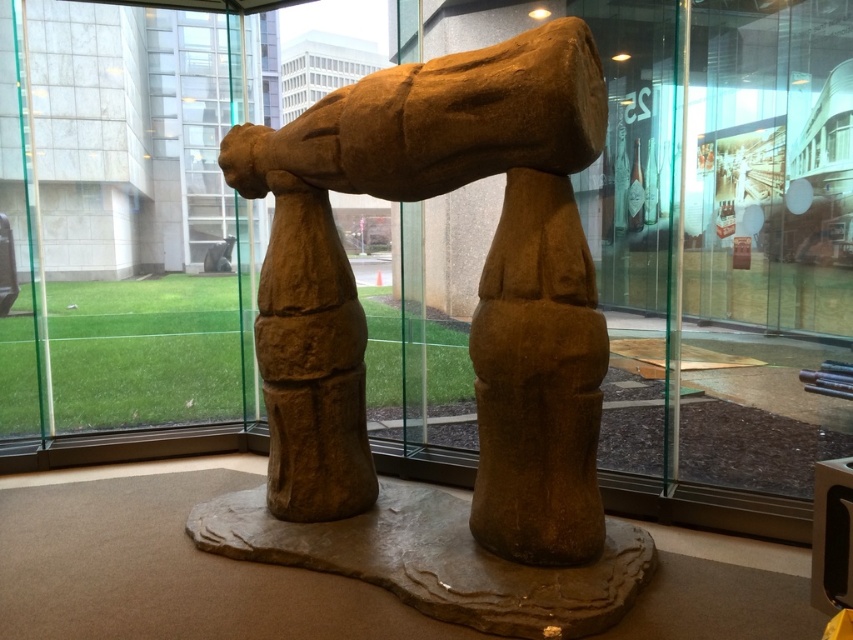
Question: Which point appears closest to the camera in this image?

Choices:
 (A) (216, 182)
 (B) (381, 512)

Answer: (B)

Question: Can you confirm if brown stone sculpture at center is thinner than transparent glass door at upper left?

Choices:
 (A) no
 (B) yes

Answer: (A)

Question: Which object is farther from the camera taking this photo?

Choices:
 (A) brown stone sculpture at center
 (B) transparent glass door at upper left

Answer: (B)

Question: Can you confirm if brown stone sculpture at center is bigger than transparent glass door at upper left?

Choices:
 (A) yes
 (B) no

Answer: (B)

Question: Does brown stone sculpture at center appear on the right side of transparent glass door at upper left?

Choices:
 (A) no
 (B) yes

Answer: (B)

Question: Which point appears farthest from the camera in this image?

Choices:
 (A) click(x=514, y=627)
 (B) click(x=134, y=67)

Answer: (B)